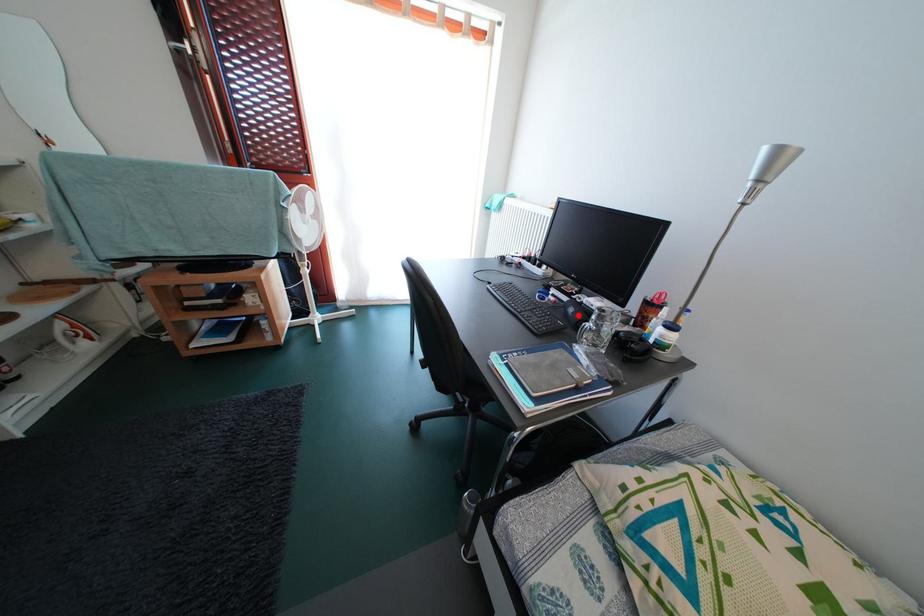
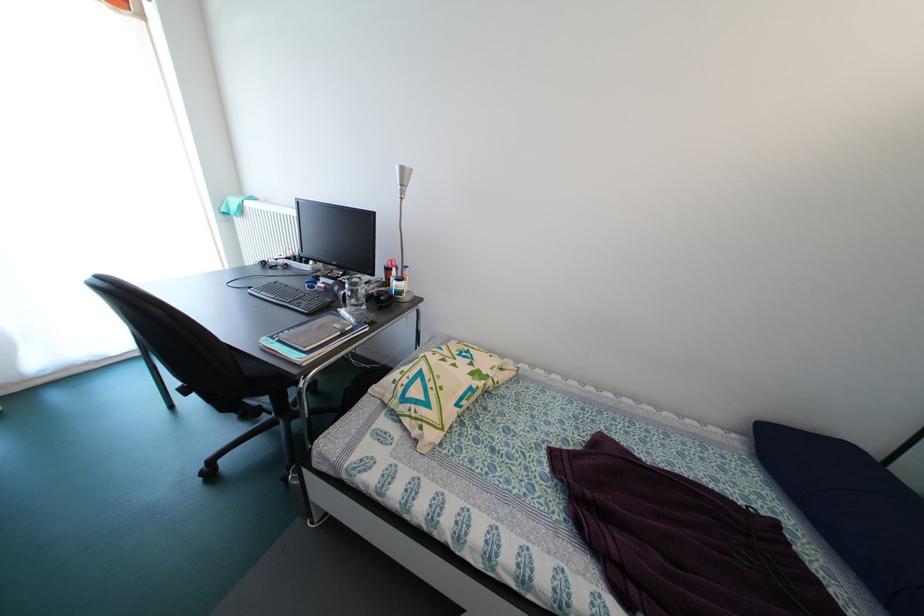
In the second image, find the point that corresponds to the highlighted location in the first image.

(344, 294)